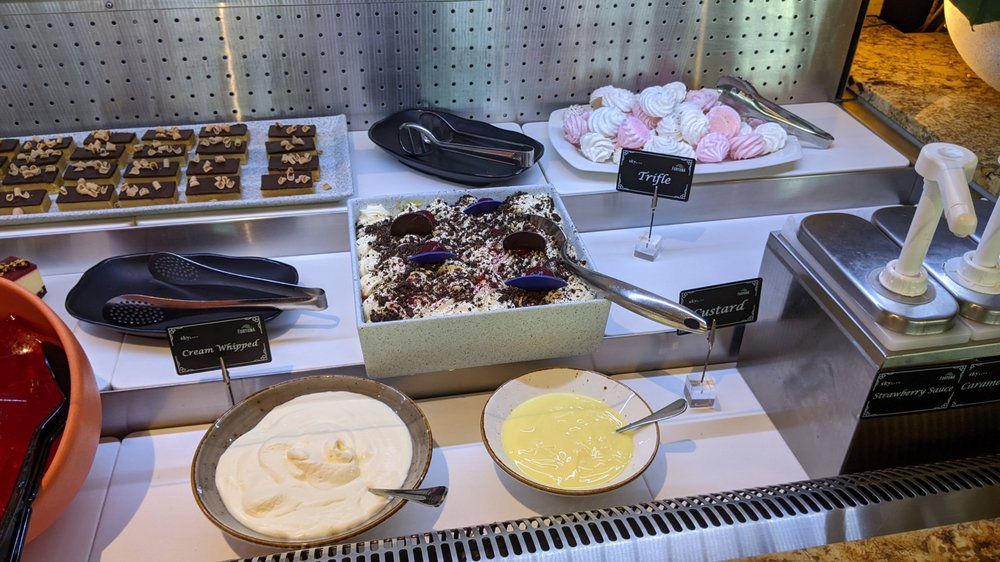
At what (x,y) coordinates should I click in order to perform the action: click on brown bowl. Please return your answer as a coordinate pair (x, y). Looking at the image, I should click on (423, 445).